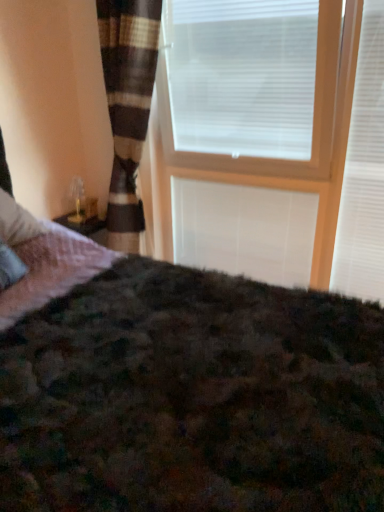
What do you see at coordinates (252, 91) in the screenshot? I see `white plastic blinds at upper center, which is the first window blind from left to right` at bounding box center [252, 91].

This screenshot has height=512, width=384. What do you see at coordinates (274, 133) in the screenshot? I see `wooden frame at upper center` at bounding box center [274, 133].

I want to click on wooden frame at upper center, so click(x=274, y=133).

Describe the element at coordinates (364, 172) in the screenshot. This screenshot has width=384, height=512. I see `white matte window blind at upper right, which ranks as the 2th window blind in left-to-right order` at that location.

This screenshot has height=512, width=384. I want to click on white matte blind at center, so click(x=244, y=230).

Considering the sizes of objects wooden frame at upper center and white matte blind at center in the image provided, who is taller, wooden frame at upper center or white matte blind at center?

Standing taller between the two is wooden frame at upper center.

Considering the points (313, 169) and (286, 279), which point is behind, point (313, 169) or point (286, 279)?

Positioned behind is point (286, 279).

Considering the sizes of objects wooden frame at upper center and white matte blind at center in the image provided, who is thinner, wooden frame at upper center or white matte blind at center?

white matte blind at center is thinner.

From the image's perspective, who appears lower, wooden frame at upper center or white matte blind at center?

white matte blind at center, from the image's perspective.

Identify the location of blind that appears below the white matte window blind at upper right, placed as the first window blind when sorted from right to left (from the image's perspective). This screenshot has height=512, width=384. (244, 230).

Between white matte blind at center and white matte window blind at upper right, which ranks as the 2th window blind in left-to-right order, which one appears on the left side from the viewer's perspective?

white matte blind at center is more to the left.

Considering the sizes of objects white matte blind at center and white matte window blind at upper right, which ranks as the 2th window blind in left-to-right order, in the image provided, who is smaller, white matte blind at center or white matte window blind at upper right, which ranks as the 2th window blind in left-to-right order,?

Smaller between the two is white matte blind at center.

Consider the image. From a real-world perspective, who is located lower, white matte blind at center or white matte window blind at upper right, placed as the first window blind when sorted from right to left?

In real-world perspective, white matte blind at center is lower.

Is point (238, 224) positioned after point (284, 94)?

Yes, point (238, 224) is farther from viewer.

Considering the relative sizes of white matte blind at center and white plastic blinds at upper center, which is the first window blind from left to right, in the image provided, is white matte blind at center bigger than white plastic blinds at upper center, which is the first window blind from left to right,?

No.

Could you tell me if white matte blind at center is facing white plastic blinds at upper center, which is the first window blind from left to right?

No, white matte blind at center does not turn towards white plastic blinds at upper center, which is the first window blind from left to right.

Where is `blind located below the white plastic blinds at upper center, which is the first window blind from left to right (from the image's perspective)`? blind located below the white plastic blinds at upper center, which is the first window blind from left to right (from the image's perspective) is located at coordinates point(244,230).

Does wooden frame at upper center touch white matte window blind at upper right, which ranks as the 2th window blind in left-to-right order?

wooden frame at upper center and white matte window blind at upper right, which ranks as the 2th window blind in left-to-right order, are clearly separated.

Identify the location of window frame above the white matte window blind at upper right, which ranks as the 2th window blind in left-to-right order (from a real-world perspective). Image resolution: width=384 pixels, height=512 pixels. (274, 133).

Which object is further away from the camera taking this photo, wooden frame at upper center or white matte window blind at upper right, which ranks as the 2th window blind in left-to-right order?

white matte window blind at upper right, which ranks as the 2th window blind in left-to-right order, is more distant.

Is white matte window blind at upper right, placed as the first window blind when sorted from right to left, oriented towards white matte blind at center?

No, white matte window blind at upper right, placed as the first window blind when sorted from right to left, is not facing towards white matte blind at center.

Locate an element on the screen. The image size is (384, 512). blind on the left of white matte window blind at upper right, placed as the first window blind when sorted from right to left is located at coordinates (244, 230).

Looking at the image, does white matte window blind at upper right, which ranks as the 2th window blind in left-to-right order, seem bigger or smaller compared to white matte blind at center?

Clearly, white matte window blind at upper right, which ranks as the 2th window blind in left-to-right order, is larger in size than white matte blind at center.

How far apart are white matte window blind at upper right, which ranks as the 2th window blind in left-to-right order, and white plastic blinds at upper center, the 2th window blind viewed from the right?

They are 16.91 inches apart.

Considering the points (341, 284) and (295, 73), which point is in front, point (341, 284) or point (295, 73)?

Positioned in front is point (295, 73).

From the image's perspective, which one is positioned higher, white matte window blind at upper right, placed as the first window blind when sorted from right to left, or white plastic blinds at upper center, the 2th window blind viewed from the right?

white plastic blinds at upper center, the 2th window blind viewed from the right, appears higher in the image.

Looking at this image, which of these two, white matte window blind at upper right, which ranks as the 2th window blind in left-to-right order, or white plastic blinds at upper center, the 2th window blind viewed from the right, is wider?

Wider between the two is white plastic blinds at upper center, the 2th window blind viewed from the right.

Is wooden frame at upper center not inside white plastic blinds at upper center, which is the first window blind from left to right?

Yes, wooden frame at upper center is not within white plastic blinds at upper center, which is the first window blind from left to right.

Is point (362, 64) closer or farther from the camera than point (326, 81)?

Clearly, point (362, 64) is closer to the camera than point (326, 81).

Considering the positions of objects wooden frame at upper center and white plastic blinds at upper center, the 2th window blind viewed from the right, in the image provided, who is more to the left, wooden frame at upper center or white plastic blinds at upper center, the 2th window blind viewed from the right,?

white plastic blinds at upper center, the 2th window blind viewed from the right.

In order to click on window blind above the wooden frame at upper center (from a real-world perspective) in this screenshot , I will do `click(252, 91)`.

Where is `blind on the left of wooden frame at upper center`? This screenshot has width=384, height=512. blind on the left of wooden frame at upper center is located at coordinates (244, 230).

Starting from the white matte blind at center, which window blind is the 2nd one in front? Please provide its 2D coordinates.

[(364, 172)]

Considering their positions, is wooden frame at upper center positioned closer to white plastic blinds at upper center, the 2th window blind viewed from the right, than white matte blind at center?

wooden frame at upper center is closer to white plastic blinds at upper center, the 2th window blind viewed from the right.

From the image, which object appears to be nearer to white matte blind at center, wooden frame at upper center or white plastic blinds at upper center, which is the first window blind from left to right?

Among the two, wooden frame at upper center is located nearer to white matte blind at center.

Based on their spatial positions, is white plastic blinds at upper center, the 2th window blind viewed from the right, or white matte window blind at upper right, placed as the first window blind when sorted from right to left, further from white matte blind at center?

white matte window blind at upper right, placed as the first window blind when sorted from right to left, is further to white matte blind at center.

Looking at the image, which one is located closer to white matte window blind at upper right, placed as the first window blind when sorted from right to left, wooden frame at upper center or white plastic blinds at upper center, the 2th window blind viewed from the right?

Based on the image, wooden frame at upper center appears to be nearer to white matte window blind at upper right, placed as the first window blind when sorted from right to left.

Looking at the image, which one is located closer to white plastic blinds at upper center, the 2th window blind viewed from the right, white matte blind at center or wooden frame at upper center?

Based on the image, wooden frame at upper center appears to be nearer to white plastic blinds at upper center, the 2th window blind viewed from the right.

Considering their positions, is white plastic blinds at upper center, which is the first window blind from left to right, positioned further to white matte window blind at upper right, placed as the first window blind when sorted from right to left, than wooden frame at upper center?

The object further to white matte window blind at upper right, placed as the first window blind when sorted from right to left, is white plastic blinds at upper center, which is the first window blind from left to right.

Based on their spatial positions, is white matte blind at center or wooden frame at upper center closer to white matte window blind at upper right, which ranks as the 2th window blind in left-to-right order?

wooden frame at upper center.

Based on the photo, when comparing their distances from white matte window blind at upper right, placed as the first window blind when sorted from right to left, does white matte blind at center or white plastic blinds at upper center, which is the first window blind from left to right, seem further?

white matte blind at center.

Find the location of `window blind between white plastic blinds at upper center, which is the first window blind from left to right, and white matte blind at center vertically`. window blind between white plastic blinds at upper center, which is the first window blind from left to right, and white matte blind at center vertically is located at coordinates 364,172.

At what (x,y) coordinates should I click in order to perform the action: click on window frame between white plastic blinds at upper center, the 2th window blind viewed from the right, and white matte window blind at upper right, which ranks as the 2th window blind in left-to-right order. Please return your answer as a coordinate pair (x, y). This screenshot has height=512, width=384. Looking at the image, I should click on (274, 133).

Where is `window frame that lies between white plastic blinds at upper center, the 2th window blind viewed from the right, and white matte blind at center from top to bottom`? Image resolution: width=384 pixels, height=512 pixels. window frame that lies between white plastic blinds at upper center, the 2th window blind viewed from the right, and white matte blind at center from top to bottom is located at coordinates (274, 133).